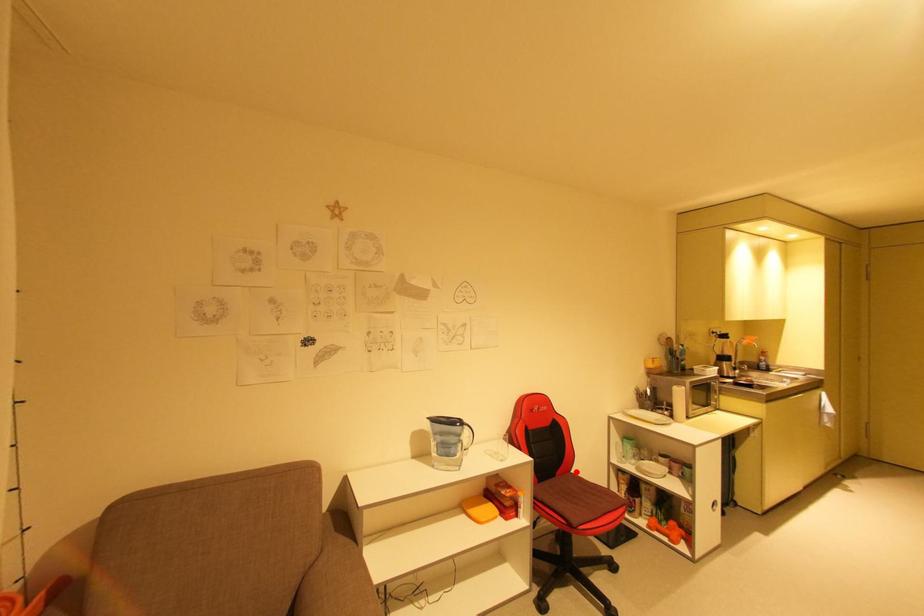
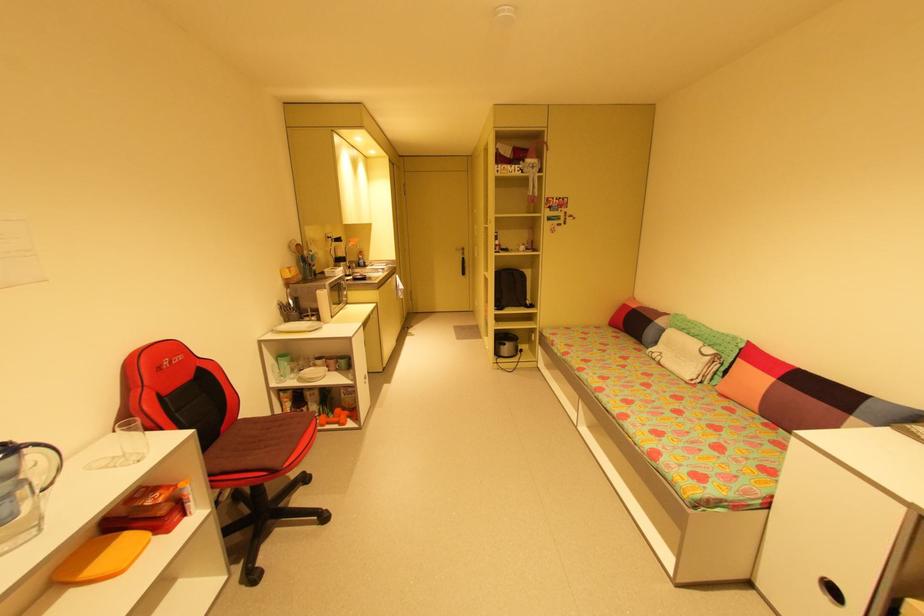
Where in the second image is the point corresponding to the highlighted location from the first image?

(244, 418)